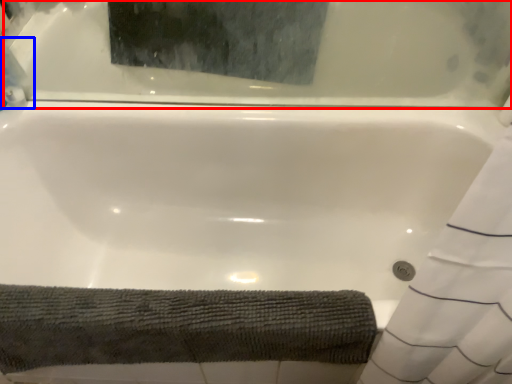
Question: Which object appears closest to the camera in this image, bathtub (highlighted by a red box) or cleaning product (highlighted by a blue box)?

Choices:
 (A) bathtub
 (B) cleaning product

Answer: (A)